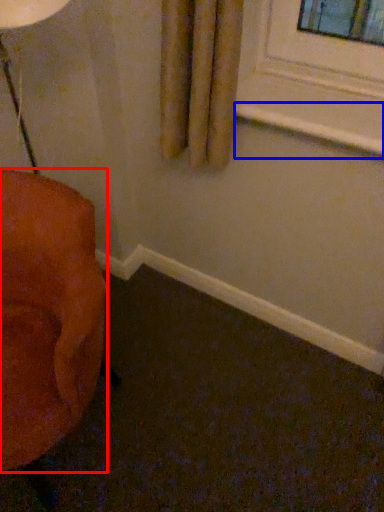
Question: Which object is further to the camera taking this photo, furniture (highlighted by a red box) or window sill (highlighted by a blue box)?

Choices:
 (A) furniture
 (B) window sill

Answer: (B)